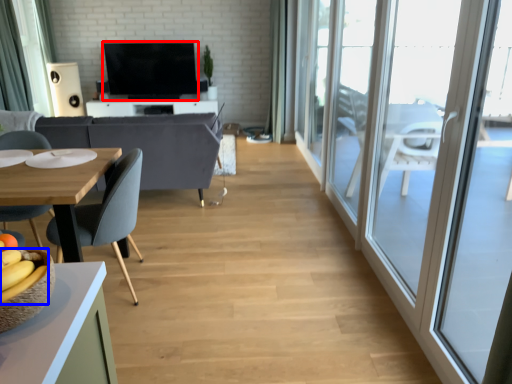
Question: Which object is closer to the camera taking this photo, television (highlighted by a red box) or banana (highlighted by a blue box)?

Choices:
 (A) television
 (B) banana

Answer: (B)